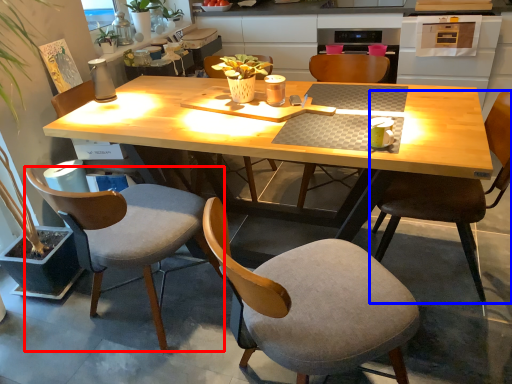
Question: Which object appears farthest to the camera in this image, chair (highlighted by a red box) or chair (highlighted by a blue box)?

Choices:
 (A) chair
 (B) chair

Answer: (B)